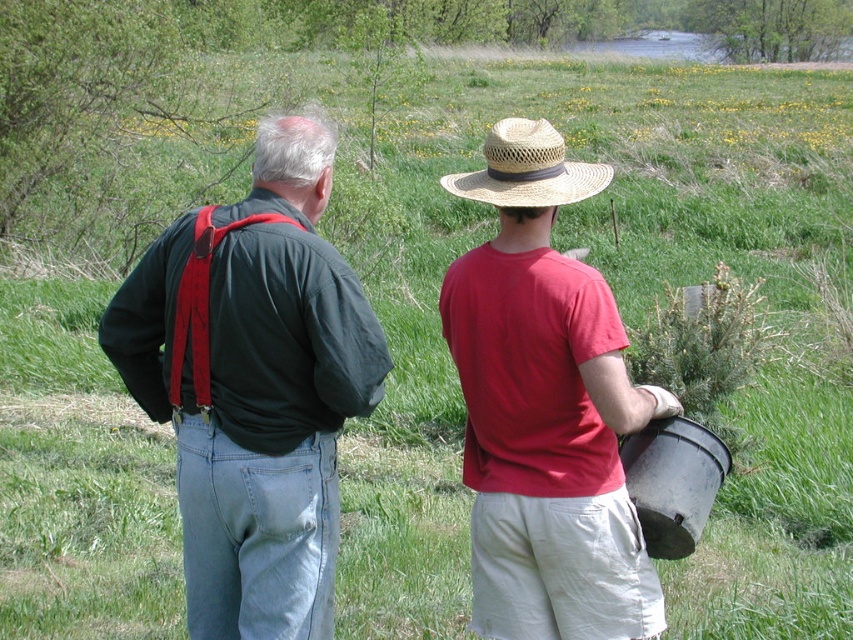
Question: Is dark green shirt at left positioned at the back of straw/textured cowboy hat at center?

Choices:
 (A) yes
 (B) no

Answer: (B)

Question: Among these objects, which one is farthest from the camera?

Choices:
 (A) dark green shirt at left
 (B) straw/textured cowboy hat at center

Answer: (B)

Question: Is dark green shirt at left wider than straw/textured cowboy hat at center?

Choices:
 (A) yes
 (B) no

Answer: (A)

Question: Which of the following is the closest to the observer?

Choices:
 (A) (625, 586)
 (B) (561, 179)

Answer: (A)

Question: Which object is closer to the camera taking this photo?

Choices:
 (A) straw/textured cowboy hat at center
 (B) dark green shirt at left
 (C) straw hat at center

Answer: (C)

Question: Does dark green shirt at left have a smaller size compared to straw hat at center?

Choices:
 (A) yes
 (B) no

Answer: (B)